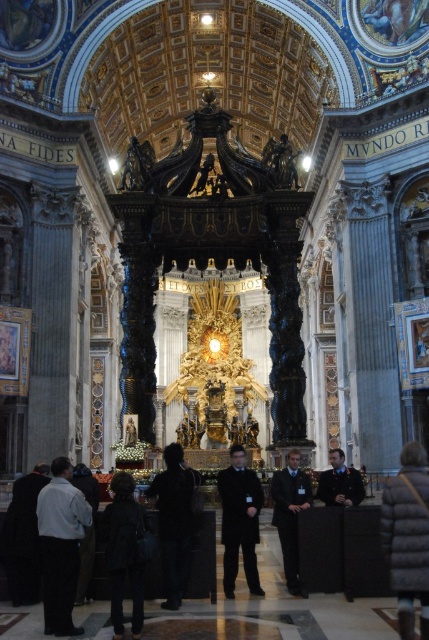
Question: Does dark gray suit at lower left have a greater width compared to dark brown leather jacket at center?

Choices:
 (A) no
 (B) yes

Answer: (B)

Question: Can you confirm if black wool coat at lower left is positioned above dark brown leather jacket at center?

Choices:
 (A) no
 (B) yes

Answer: (A)

Question: Is black fuzzy coat at lower right above dark brown leather jacket at center?

Choices:
 (A) yes
 (B) no

Answer: (A)

Question: Which is farther from the black matte coat at center?

Choices:
 (A) dark brown leather jacket at center
 (B) black fuzzy coat at lower right
 (C) black matte suit at center
 (D) black wool coat at lower left

Answer: (B)

Question: Among these objects, which one is farthest from the camera?

Choices:
 (A) dark gray suit at lower left
 (B) black fuzzy coat at lower right
 (C) dark brown leather jacket at center
 (D) black matte suit at center

Answer: (C)

Question: Which point appears closest to the camera in this image?

Choices:
 (A) (256, 593)
 (B) (72, 632)
 (C) (123, 570)
 (D) (293, 467)

Answer: (B)